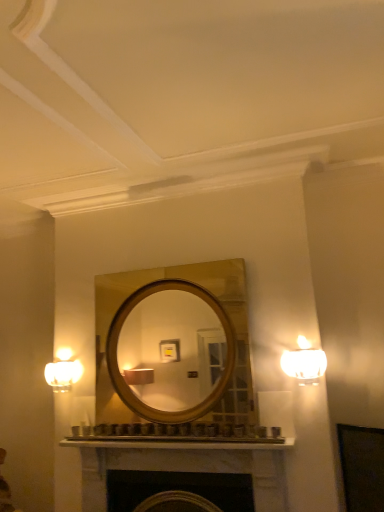
Question: Considering the positions of matte white sconce at left and white frosted glass lamp at right in the image, is matte white sconce at left wider or thinner than white frosted glass lamp at right?

Choices:
 (A) thin
 (B) wide

Answer: (A)

Question: Is point (59, 357) positioned closer to the camera than point (297, 352)?

Choices:
 (A) closer
 (B) farther

Answer: (B)

Question: Which of these objects is positioned closest to the white frosted glass lamp at right?

Choices:
 (A) matte white sconce at left
 (B) white marble fireplace at lower center

Answer: (B)

Question: Which object is positioned closest to the white marble fireplace at lower center?

Choices:
 (A) matte white sconce at left
 (B) white frosted glass lamp at right

Answer: (B)